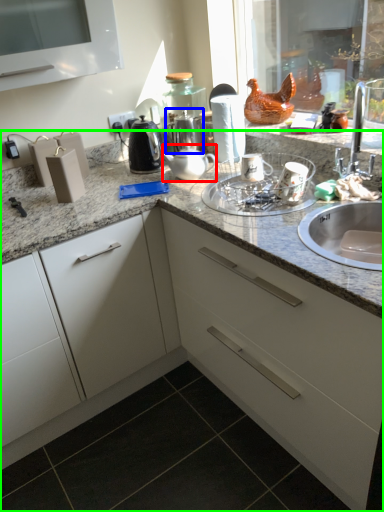
Question: Estimate the real-world distances between objects in this image. Which object is closer to tea pot (highlighted by a red box), tea pot (highlighted by a blue box) or countertop (highlighted by a green box)?

Choices:
 (A) tea pot
 (B) countertop

Answer: (A)